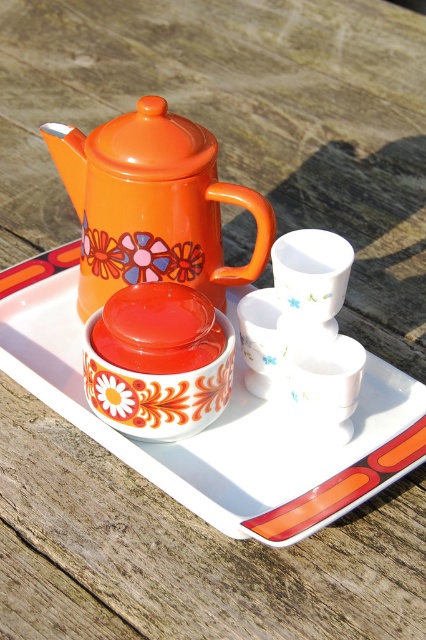
You are setting up a tea service and need to place the orange glossy teapot at upper left on the orange glossy saucer at center. Will the teapot fit on the saucer without overhanging the edges?

The orange glossy saucer at center is wider than the orange glossy teapot at upper left, so the teapot will fit on the saucer without overhanging the edges.